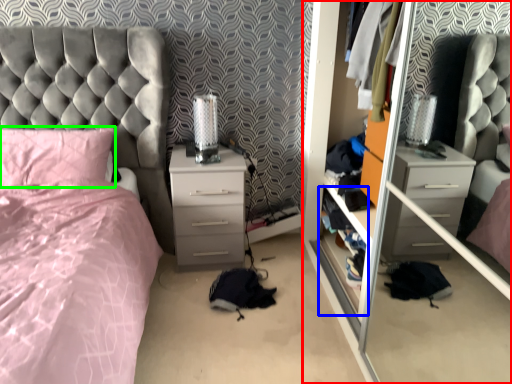
Question: Which object is positioned closest to glass door (highlighted by a red box)? Select from shelf (highlighted by a blue box) and pillow (highlighted by a green box).

Choices:
 (A) shelf
 (B) pillow

Answer: (A)